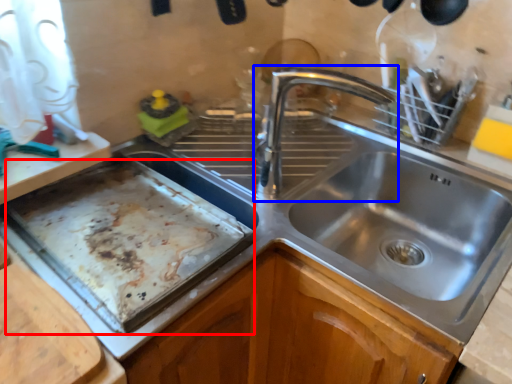
Question: Which object is closer to the camera taking this photo, baking sheet (highlighted by a red box) or tap (highlighted by a blue box)?

Choices:
 (A) baking sheet
 (B) tap

Answer: (A)